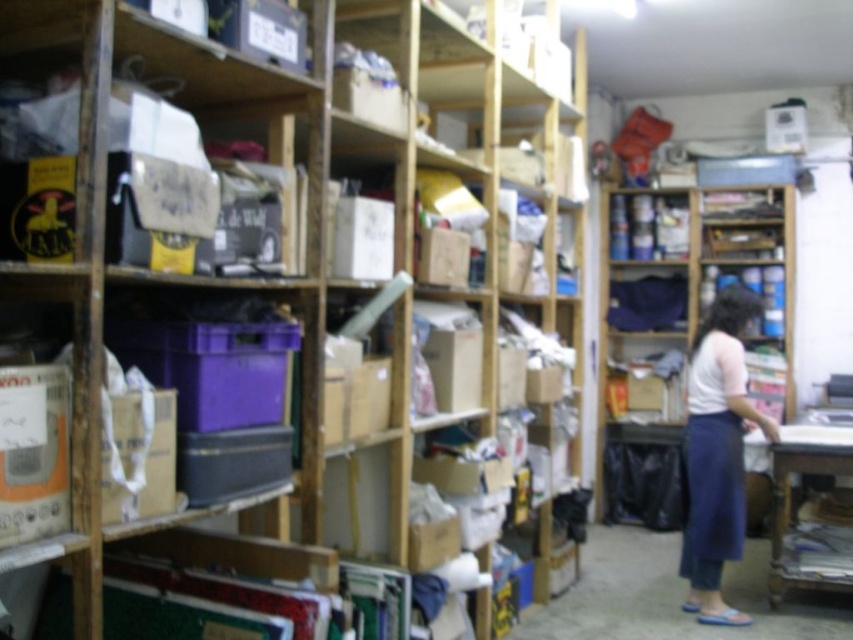
You are organizing the storage area and need to place a new item that requires a tall storage space. Which object between the wooden bookshelf at center and the blue denim apron at lower right would be more suitable for this purpose?

The wooden bookshelf at center is much taller than the blue denim apron at lower right, so it would be more suitable for storing items that require tall storage space.

You are organizing the storage area and need to move items from the wooden shelves at center to the wooden bookshelf at center. According to the layout, which direction should you move the items to place them correctly?

The wooden shelves at center is to the left of the wooden bookshelf at center, so you should move the items to the right to place them correctly.